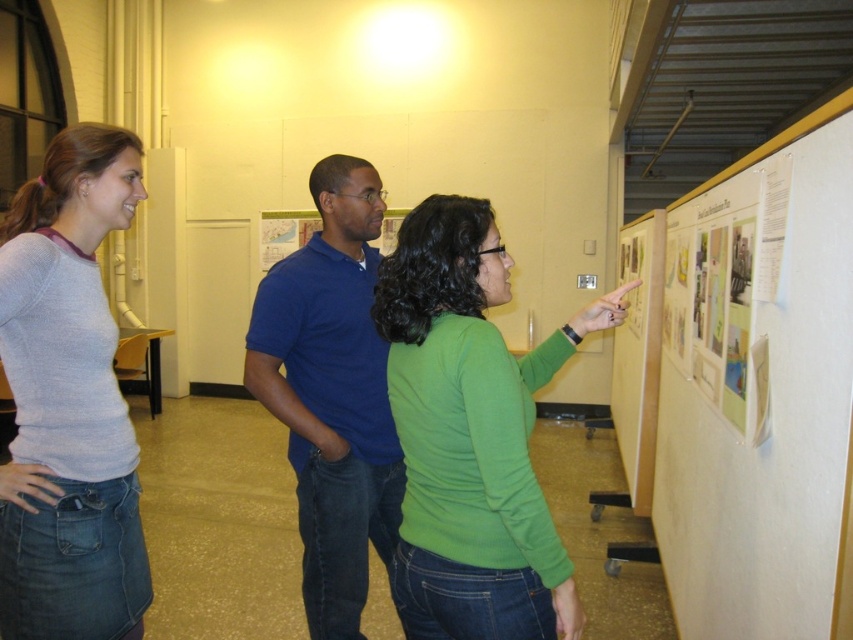
You are trying to decide which person to approach for information. The green matte shirt at upper right and the blue cotton shirt at center are both looking at the posters. Which person is shorter?

The green matte shirt at upper right is shorter than the blue cotton shirt at center because it is not as tall as the blue cotton shirt at center.

Based on the scene description, where is the light gray sweater at center located in terms of its 2D coordinates?

The light gray sweater at center is located at the 2D coordinates point (x=68, y=401).